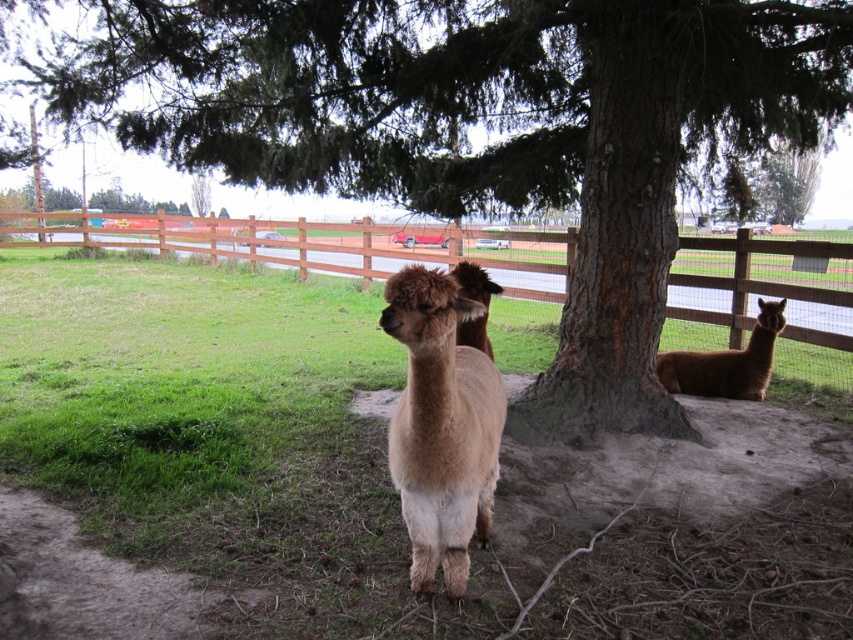
You are a photographer aiming to capture the fuzzy beige alpaca at center in the foreground while ensuring the green grass at lower left is visible in the background. Given their relative heights, will the alpaca obscure the grass?

The green grass at lower left is taller than the fuzzy beige alpaca at center, so the grass will not be obscured by the alpaca. The photographer can capture both clearly with the grass visible in the background.

You are standing in the grassy area looking at the green rough bark tree at upper center and the fuzzy beige alpaca at center. Which object is positioned to the right side?

The green rough bark tree at upper center is to the right of the fuzzy beige alpaca at center.